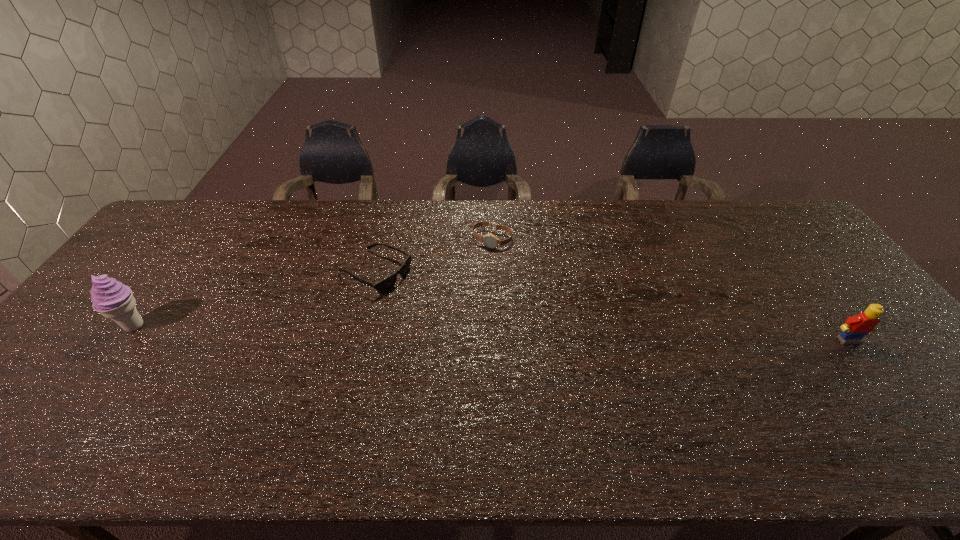
This screenshot has width=960, height=540. I want to click on free point between the watch and the third object from right to left, so click(x=434, y=256).

The image size is (960, 540). I want to click on the third closest object to the leftmost object, so click(855, 328).

Where is `object that is the second nearest to the rightmost object`? The height and width of the screenshot is (540, 960). object that is the second nearest to the rightmost object is located at coordinates (386, 284).